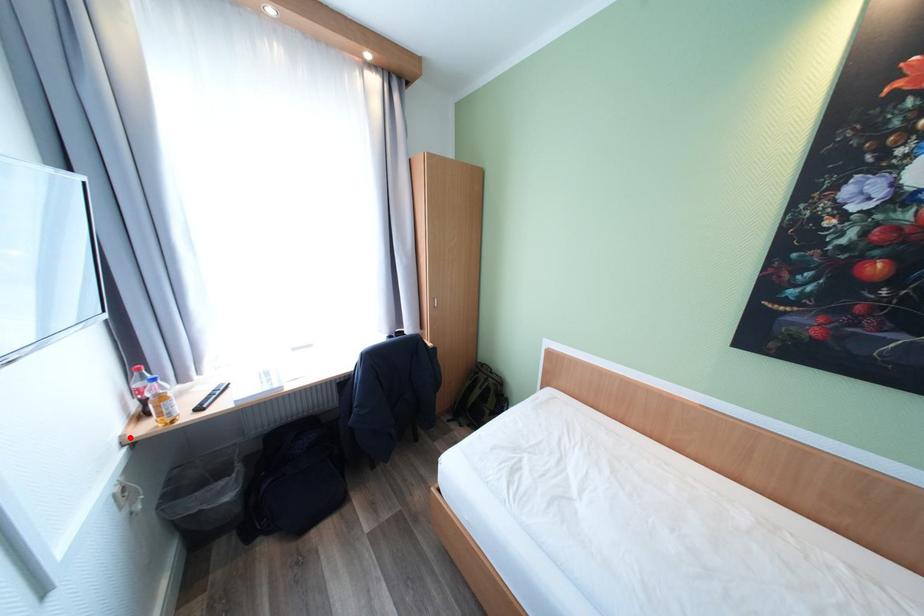
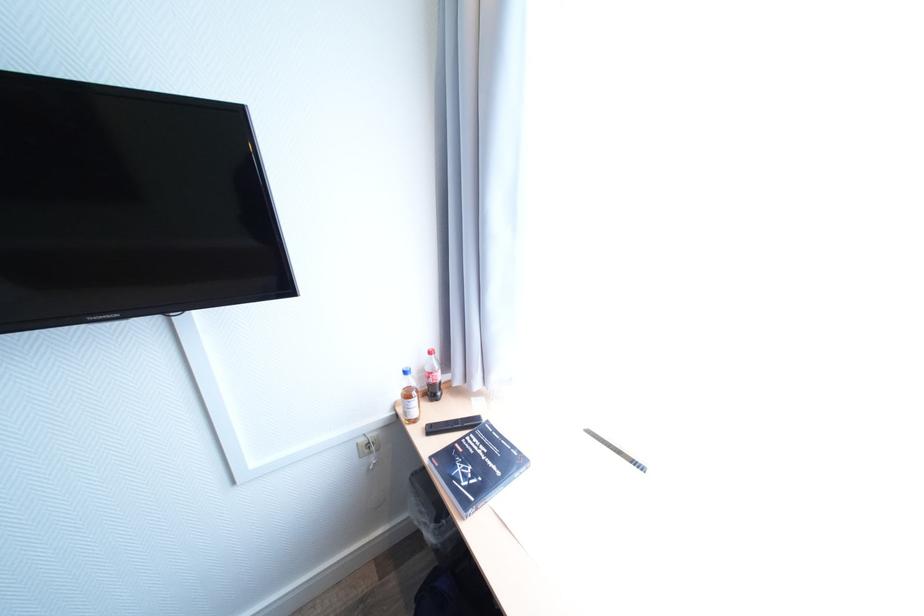
In the second image, find the point that corresponds to the highlighted location in the first image.

(403, 403)